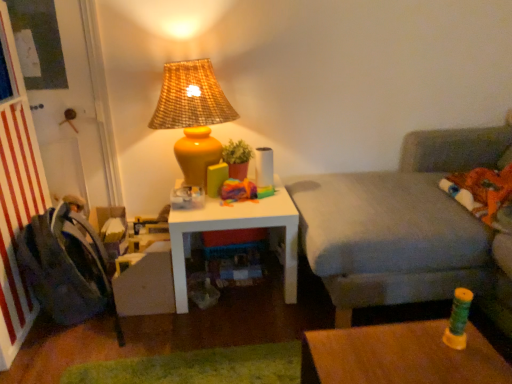
Identify the location of free point in front of dark gray fabric swivel chair at left. (64, 349).